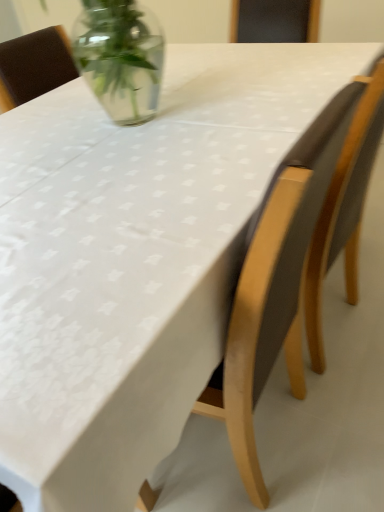
This screenshot has height=512, width=384. What do you see at coordinates (295, 266) in the screenshot?
I see `wooden chair at center` at bounding box center [295, 266].

Identify the location of wooden chair at center. (295, 266).

Locate an element on the screen. wooden chair at center is located at coordinates (295, 266).